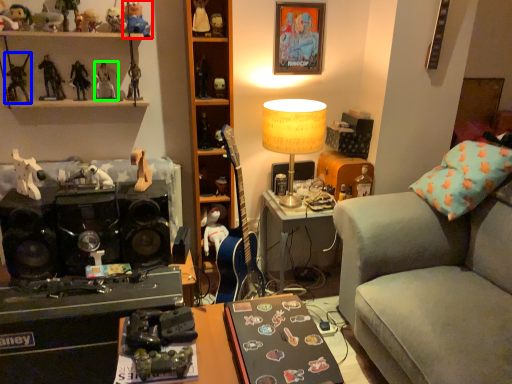
Question: Which object is the farthest from toy (highlighted by a red box)? Choose among these: toy (highlighted by a blue box) or toy (highlighted by a green box).

Choices:
 (A) toy
 (B) toy

Answer: (A)